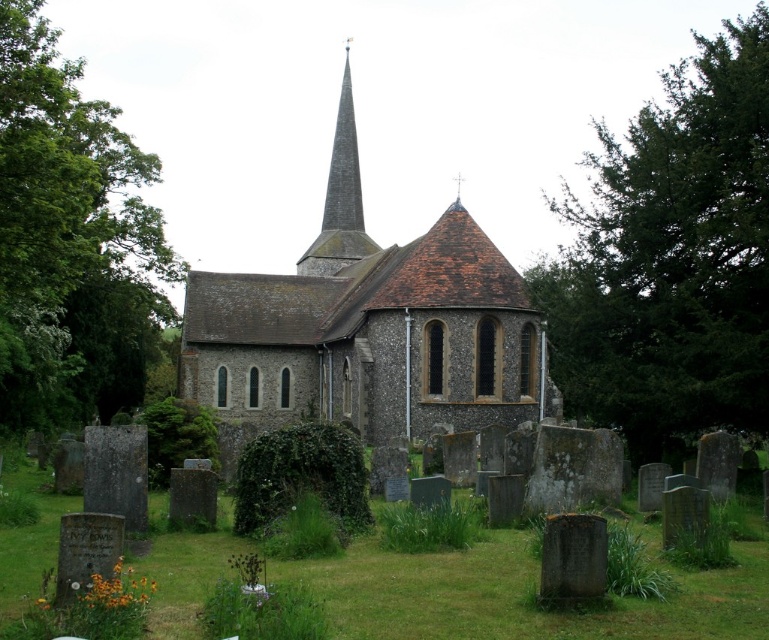
Question: Which of these objects is positioned farthest from the green leafy tree at right?

Choices:
 (A) gray stone spire at center
 (B) brown stone spire at center
 (C) green leafy tree at center

Answer: (A)

Question: Which of the following is the farthest from the observer?

Choices:
 (A) brown stone spire at center
 (B) brown stone church at center

Answer: (A)

Question: Observing the image, what is the correct spatial positioning of green leafy tree at center in reference to gray stone steeple at upper center?

Choices:
 (A) right
 (B) left

Answer: (B)

Question: Which point appears closest to the camera in this image?

Choices:
 (A) (521, 353)
 (B) (355, 154)
 (C) (98, 397)

Answer: (A)

Question: Is green leafy tree at right to the right of brown stone spire at center from the viewer's perspective?

Choices:
 (A) yes
 (B) no

Answer: (A)

Question: Does brown stone church at center have a smaller size compared to gray stone steeple at upper center?

Choices:
 (A) no
 (B) yes

Answer: (A)